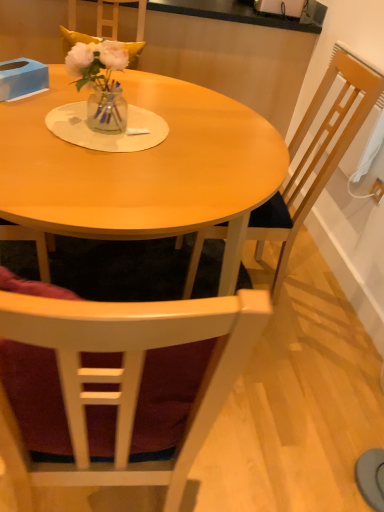
At what (x,y) coordinates should I click in order to perform the action: click on empty space that is to the right of wooden chair at right, the second chair when ordered from bottom to top. Please return your answer as a coordinate pair (x, y). Looking at the image, I should click on (329, 309).